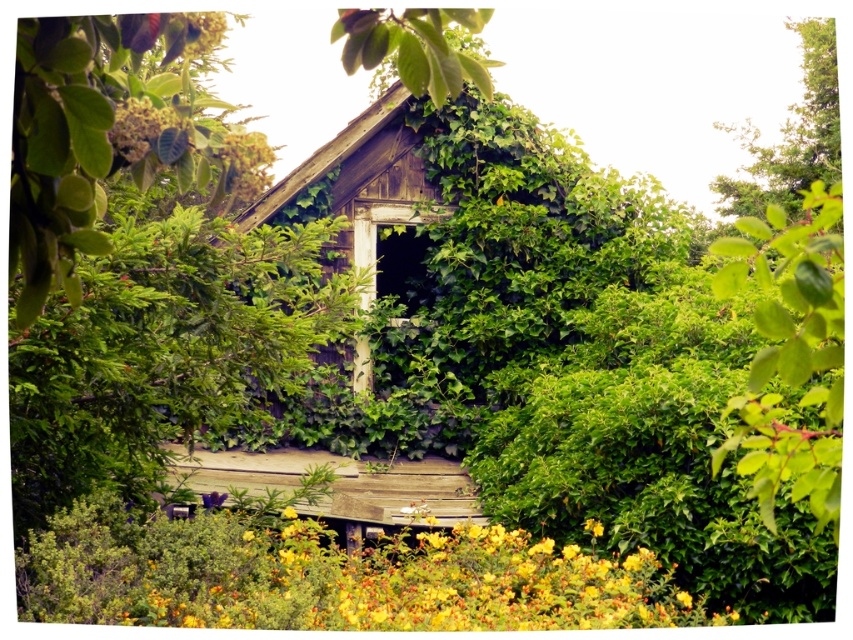
You are standing at the point marked by point (454, 268), which is the wooden hut at center. Looking around, you notice the ivy and climbing plants growing over the walls and roof. Can you determine if the wooden hut at center is currently surrounded by more greenery or more open space?

The wooden hut at center is surrounded by more greenery because the ivy and climbing plants have grown over the walls and roof, blending it into the natural surroundings, and the scene description mentions the structure is partially enveloped by lush greenery.

You are a gardener who wants to plant a new flower bed between the green matte flower at upper center and the ivy covering the building. How far apart should you space them to maintain a natural look?

The green matte flower at upper center and the ivy covering the building are 29.63 feet apart, so you should space them approximately 29.63 feet apart to maintain the natural look.